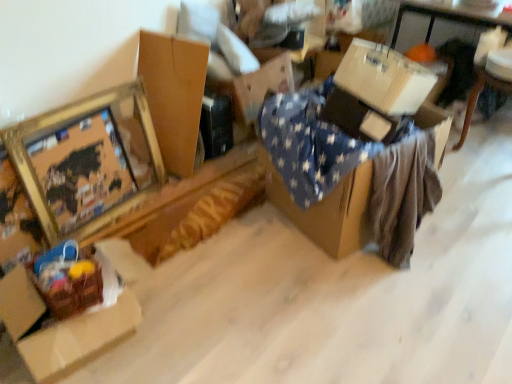
The height and width of the screenshot is (384, 512). In order to click on vacant region to the right of brown cardboard box at lower left, which is the 3th cardboard box in right-to-left order in this screenshot , I will do `click(215, 313)`.